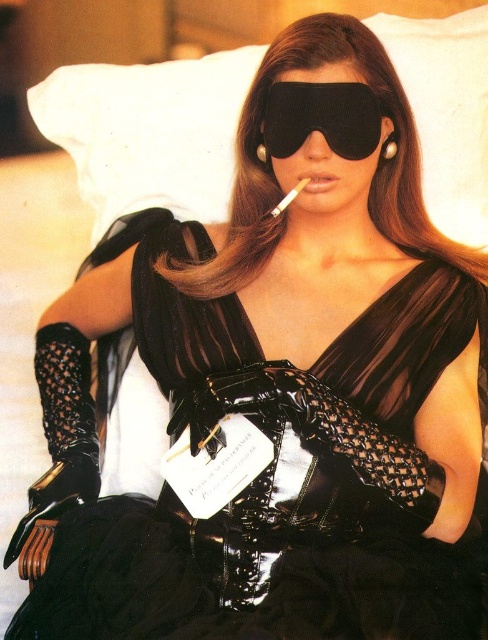
You are a photographer positioned at the scene. You want to capture a closeup shot of the white fabric pillow at upper center. Considering your current position, can you move closer to the pillow to get a better closeup without moving any other objects?

The white fabric pillow at upper center is 1.40 meters from viewer. Since the photographer is currently 1.40 meters away, they can move closer to reduce the distance for a better closeup as long as there are no obstacles in between.

You are standing 5 feet away from the image. Is the point at point (401, 44) closer to you than your current position?

The distance of point (401, 44) from viewer is 4.71 feet, so yes, the point at point 0.070, 0.082 is closer to you than your current position of 5 feet away.

You are a photographer setting up a shoot in the room. You need to position a light source to the right of the white fabric pillow at upper center. Will the light source be to the right of the black glossy dress at center?

The black glossy dress at center is to the left of the white fabric pillow at upper center. Therefore, placing the light source to the right of the white fabric pillow at upper center would also place it to the right of the black glossy dress at center.